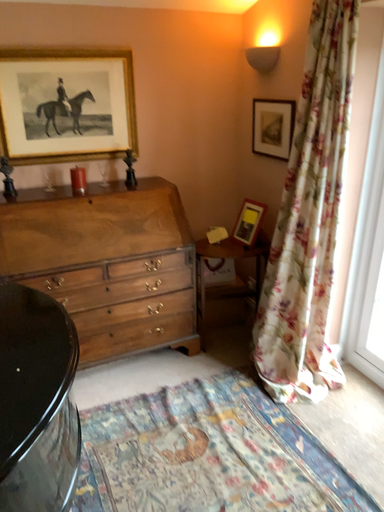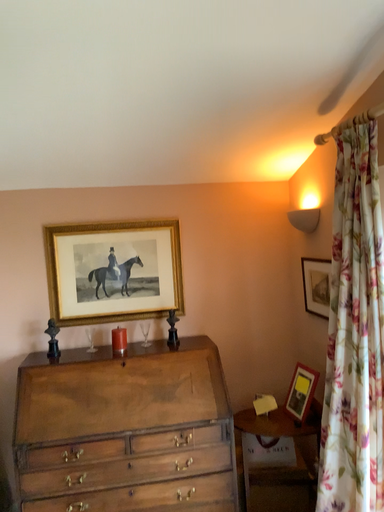
Question: Which way did the camera rotate in the video?

Choices:
 (A) rotated downward
 (B) rotated upward

Answer: (B)